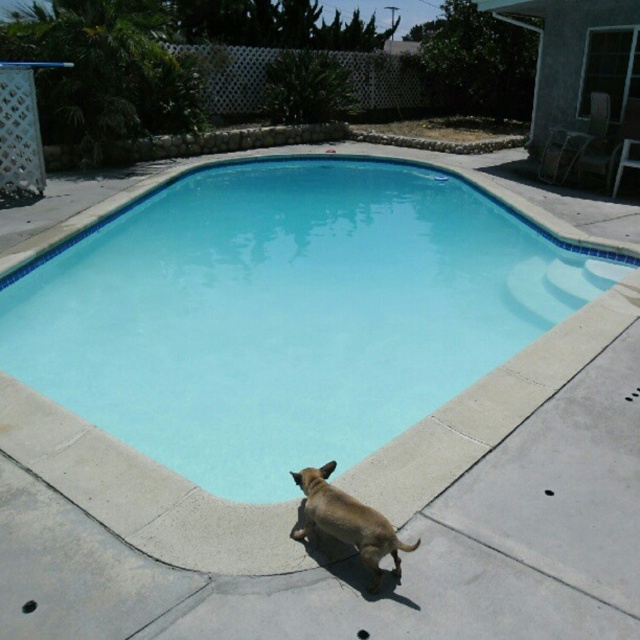
You are a photographer setting up a shot of the backyard. You want to ensure both the blue smooth pool at center and the brown matte dog at lower center are clearly visible in the frame. Given their sizes, which object will require more space in the composition?

The blue smooth pool at center requires more space in the composition because it is larger in size than the brown matte dog at lower center.

You are a photographer setting up a shot of the blue smooth pool at center and the brown matte dog at lower center. If you want to frame both subjects so that the pool takes up more horizontal space in the photo than the dog, how should you position your camera?

Position the camera so that the blue smooth pool at center is wider in the frame than the brown matte dog at lower center, since the blue smooth pool at center is wider than the brown matte dog at lower center according to the description.